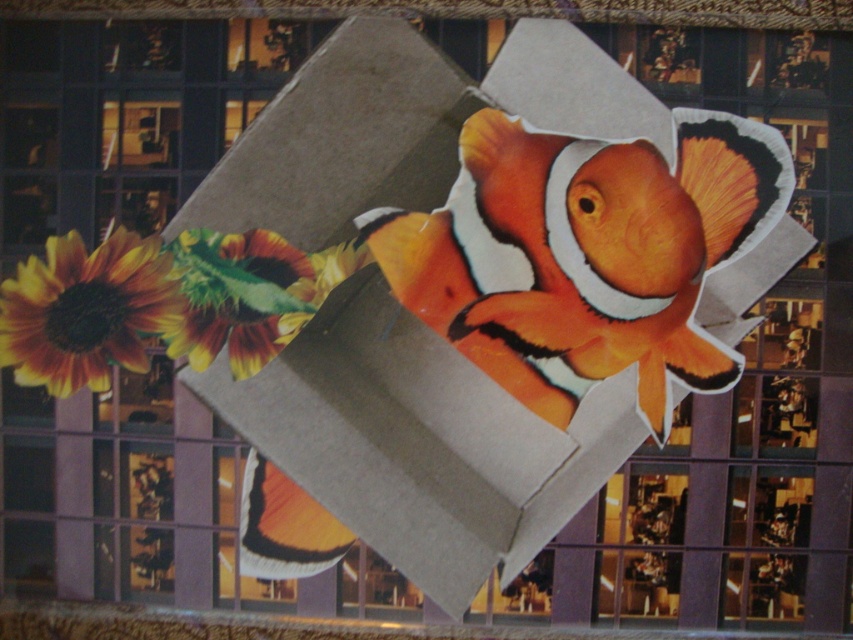
You are an artist creating a painting inspired by the image. You want to ensure the orange matte clownfish at center and the yellow matte sunflower at lower left are proportionally accurate. Which object should you paint first to maintain the correct size relationship?

You should paint the orange matte clownfish at center first because it is larger than the yellow matte sunflower at lower left, so starting with the larger object ensures proper scaling when adding the smaller one.

You are standing at the origin point in the image. Which of the two points, point (300, 161) or point (306, 268), is closer to you?

Point (300, 161) is in front of point (306, 268), so it is closer to you.

You are holding a camera and want to take a closeup photo of the matte gray cardboard box at center. The camera requires the subject to be at least 1.5 meters away for proper focus. Can you take the photo without moving the box?

The matte gray cardboard box at center is 1.32 meters away from camera, which is closer than the required 1.5 meters for proper focus. Therefore, you cannot take the photo without moving the box closer or adjusting the camera settings.